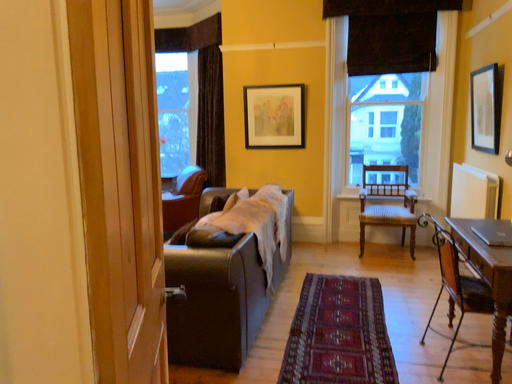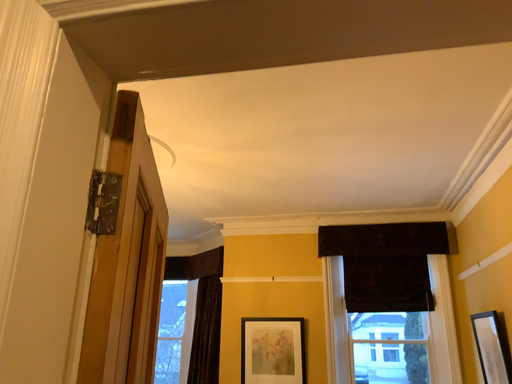
Question: How did the camera likely rotate when shooting the video?

Choices:
 (A) rotated upward
 (B) rotated downward

Answer: (A)